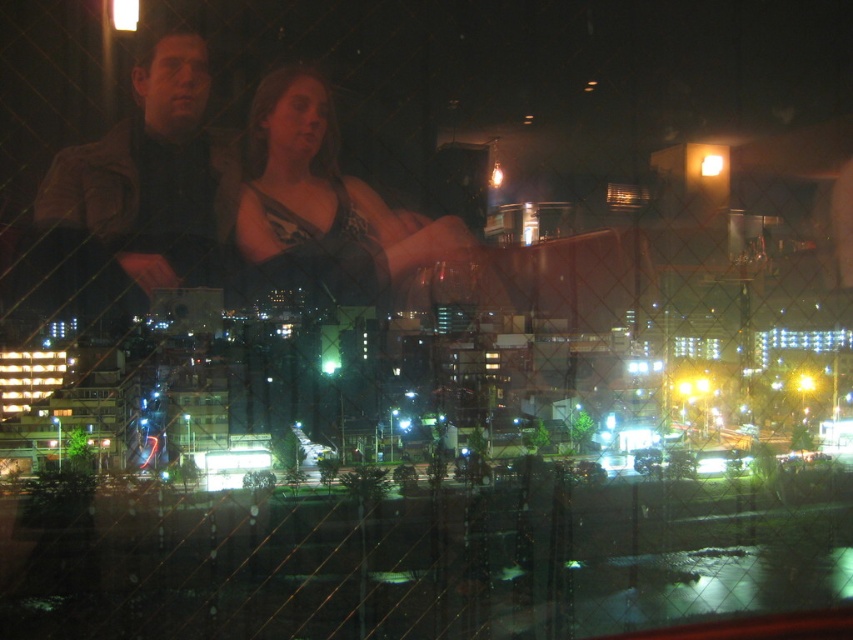
You are standing in the room and looking through the window. There are two points marked on the window, point (143, 250) and point (717, 342). Which point is closer to you?

Point (143, 250) is closer to the viewer than point (717, 342).

You are an architect designing a new building and want to place a window in a way that the leather jacket at center will be visible from the outside. Given that the window has a grid pattern and the jacket is at coordinates 0.297, 0.278, can you confirm if the jacket is within the window frame?

The leather jacket at center is located at coordinates (236, 189), so it is within the window frame as the coordinates fall within the grid pattern of the window.